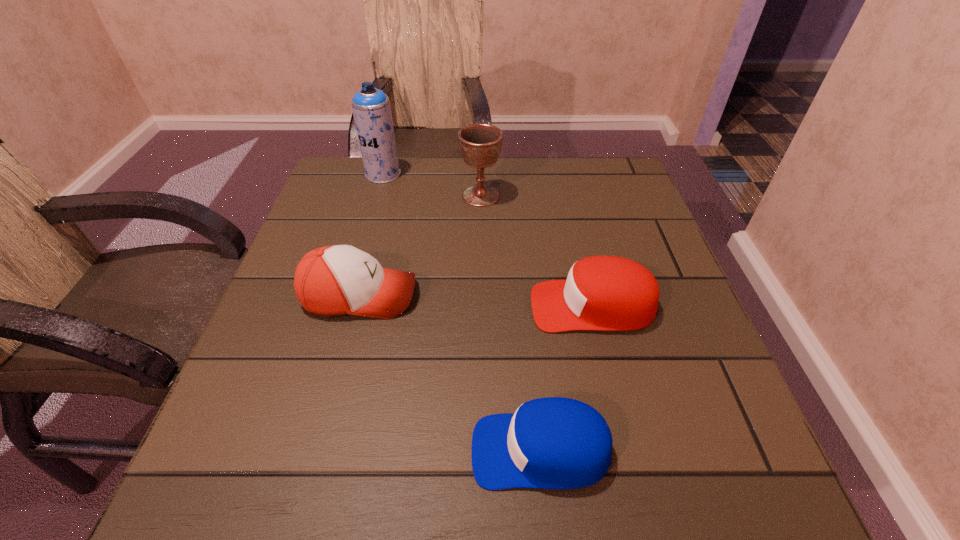
In the image, there is a desktop. At what (x,y) coordinates should I click in order to perform the action: click on free region at the far edge. Please return your answer as a coordinate pair (x, y). The image size is (960, 540). Looking at the image, I should click on (510, 160).

You are a GUI agent. You are given a task and a screenshot of the screen. Output one action in this format:
    pyautogui.click(x=<x>, y=<y>)
    Task: Click on the vacant space at the left edge
    The width and height of the screenshot is (960, 540).
    Given the screenshot: What is the action you would take?
    pyautogui.click(x=352, y=208)

At what (x,y) coordinates should I click in order to perform the action: click on free spot at the right edge of the desktop. Please return your answer as a coordinate pair (x, y). The height and width of the screenshot is (540, 960). Looking at the image, I should click on (x=660, y=417).

The height and width of the screenshot is (540, 960). What are the coordinates of `vacant position at the near left corner of the desktop` in the screenshot? It's located at (275, 476).

At what (x,y) coordinates should I click in order to perform the action: click on vacant area at the far right corner of the desktop. Please return your answer as a coordinate pair (x, y). Image resolution: width=960 pixels, height=540 pixels. Looking at the image, I should click on (576, 187).

In the image, there is a desktop. Identify the location of vacant space at the near right corner. (755, 514).

Locate an element on the screen. The width and height of the screenshot is (960, 540). free spot between the tallest object and the leftmost baseball cap is located at coordinates (372, 235).

In order to click on empty space that is in between the leftmost baseball cap and the shortest object in this screenshot , I will do `click(450, 373)`.

Find the location of a particular element. The height and width of the screenshot is (540, 960). vacant space that's between the farthest object and the leftmost baseball cap is located at coordinates (372, 235).

This screenshot has height=540, width=960. In order to click on empty space between the shortest baseball cap and the farthest object in this screenshot , I will do `click(462, 312)`.